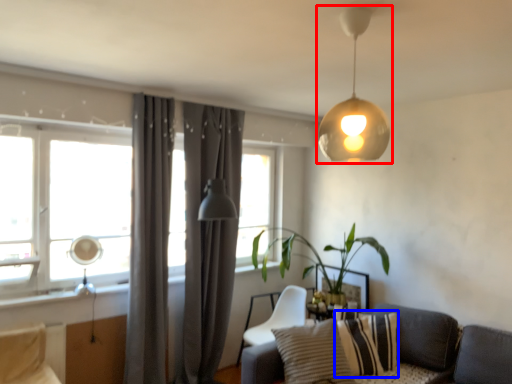
Question: Which object is further to the camera taking this photo, lamp (highlighted by a red box) or pillow (highlighted by a blue box)?

Choices:
 (A) lamp
 (B) pillow

Answer: (B)